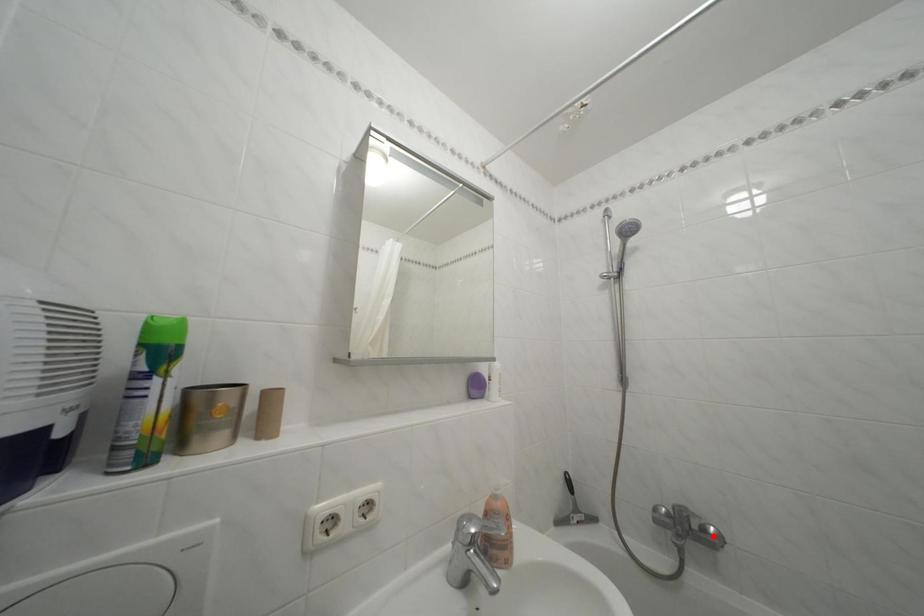
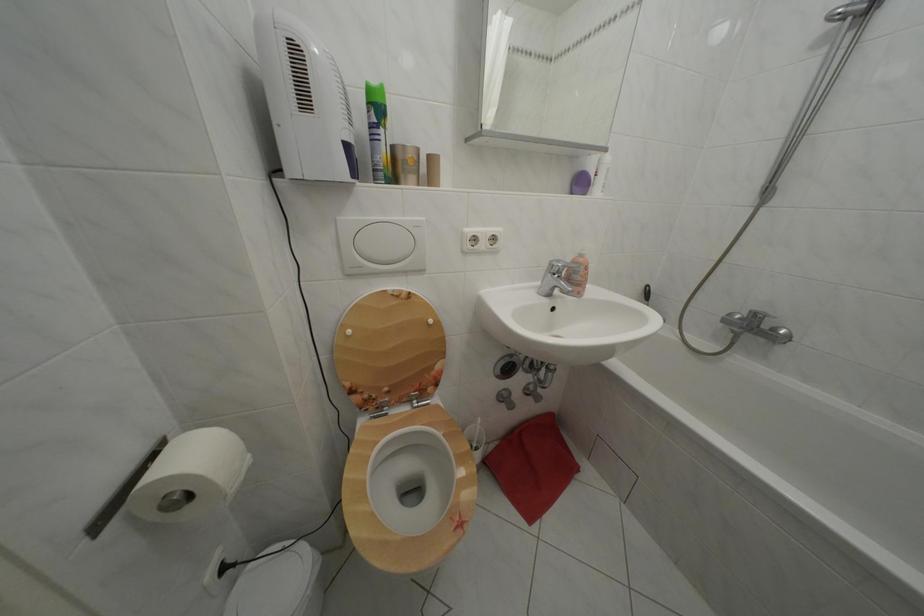
Locate, in the second image, the point that corresponds to the highlighted location in the first image.

(783, 336)